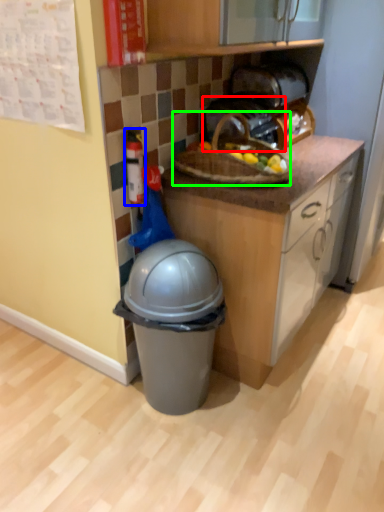
Question: Which object is the closest to the toaster (highlighted by a red box)? Choose among these: toy (highlighted by a blue box) or picnic basket (highlighted by a green box).

Choices:
 (A) toy
 (B) picnic basket

Answer: (B)